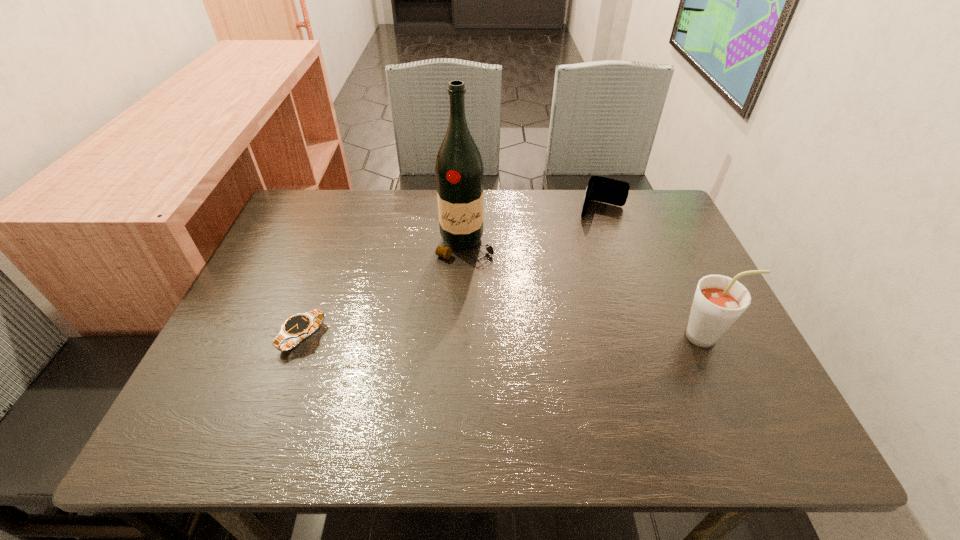
Locate an element on the screen. object that is at the far right corner is located at coordinates (602, 189).

The width and height of the screenshot is (960, 540). In order to click on free point at the far edge in this screenshot , I will do `click(508, 222)`.

Identify the location of free space at the near edge. The height and width of the screenshot is (540, 960). (628, 397).

Image resolution: width=960 pixels, height=540 pixels. I want to click on free space at the right edge of the desktop, so click(x=684, y=288).

This screenshot has height=540, width=960. What are the coordinates of `vacant region at the far left corner of the desktop` in the screenshot? It's located at (310, 239).

Identify the location of vacant region at the near left corner of the desktop. (196, 383).

The height and width of the screenshot is (540, 960). Find the location of `vacant space at the far right corner of the desktop`. vacant space at the far right corner of the desktop is located at coordinates (639, 237).

Locate an element on the screen. vacant space that is in between the farthest object and the second tallest object is located at coordinates (655, 273).

Locate an element on the screen. vacant point located between the second object from right to left and the tallest object is located at coordinates tap(534, 227).

What are the coordinates of `free spot between the watch and the second tallest object` in the screenshot? It's located at (505, 336).